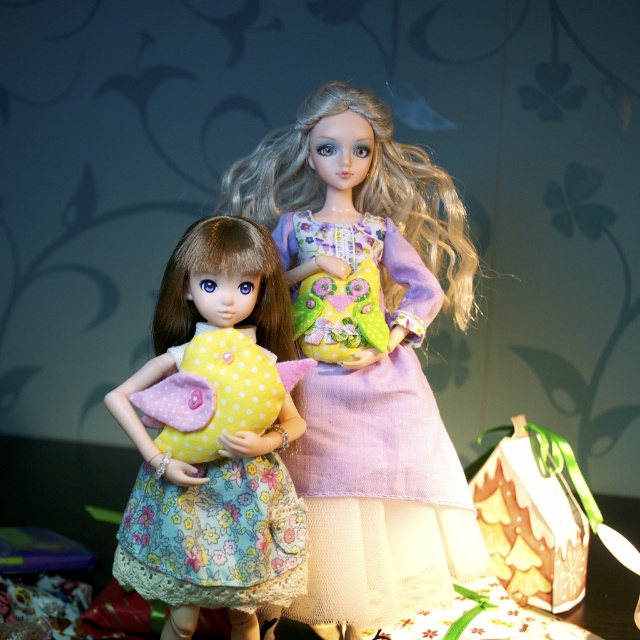
Please provide the 2D coordinates of the lavender cotton dress at center in the image. The coordinates should be in the format of a tuple with two decimal numbers separated by a comma.

The 2D coordinates of the lavender cotton dress at center are at point [378,456].

You are organizing a doll display and need to place the lavender cotton dress at center and the floral fabric dress at center on a shelf. If the shelf has limited space, which dress should you prioritize placing first to ensure both fit?

The lavender cotton dress at center is larger in size than the floral fabric dress at center, so you should prioritize placing the lavender cotton dress at center first to accommodate its larger size before placing the smaller floral fabric dress at center.